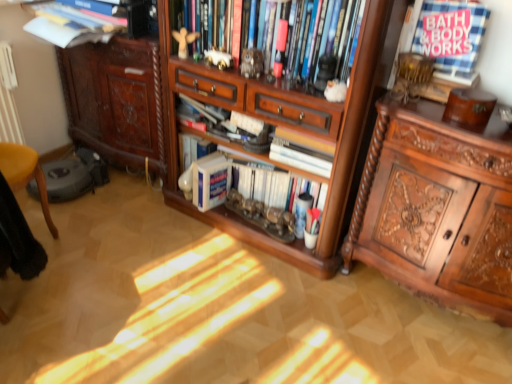
You are a GUI agent. You are given a task and a screenshot of the screen. Output one action in this format:
    pyautogui.click(x=<x>, y=<y>)
    Task: Click on the free space in front of polished wood cabinet at right, the 1th cabinetry positioned from the right
    The width and height of the screenshot is (512, 384).
    Given the screenshot: What is the action you would take?
    pyautogui.click(x=422, y=354)